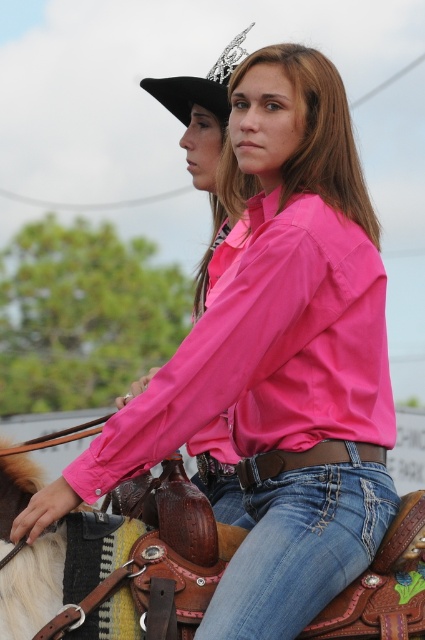
Does point (34, 588) come closer to viewer compared to point (192, 88)?

Yes, it is in front of point (192, 88).

Between brown leather saddle at lower center and black felt cowboy hat at upper left, which one has less height?

brown leather saddle at lower center is shorter.

Find the location of a particular element. Image resolution: width=425 pixels, height=640 pixels. brown leather saddle at lower center is located at coordinates (121, 566).

From the picture: Is brown leather saddle at lower center below denim at center?

No.

Does point (391, 570) come behind point (246, 605)?

That is True.

Is point (76, 570) positioned after point (266, 520)?

No, it is not.

What are the coordinates of `brown leather saddle at lower center` in the screenshot? It's located at (121, 566).

Between denim at center and black felt cowboy hat at upper left, which one has more height?

black felt cowboy hat at upper left is taller.

Image resolution: width=425 pixels, height=640 pixels. What do you see at coordinates (302, 541) in the screenshot? I see `denim at center` at bounding box center [302, 541].

At what (x,y) coordinates should I click in order to perform the action: click on denim at center. Please return your answer as a coordinate pair (x, y). Looking at the image, I should click on pyautogui.click(x=302, y=541).